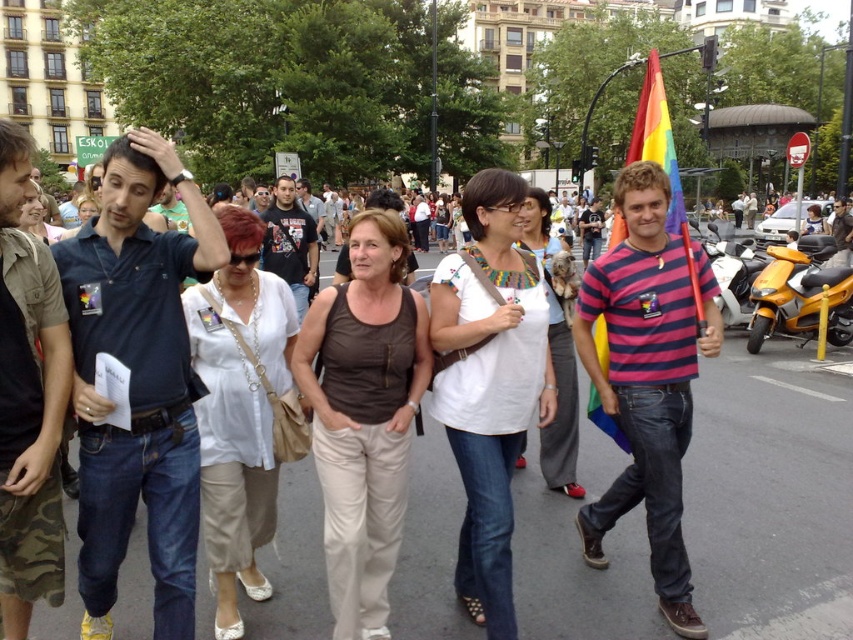
Question: Is brown cotton tank top at center wider than smooth white blouse at center?

Choices:
 (A) yes
 (B) no

Answer: (A)

Question: Is rainbow fabric flag at right smaller than yellow matte scooter at center?

Choices:
 (A) no
 (B) yes

Answer: (B)

Question: Estimate the real-world distances between objects in this image. Which object is closer to the smooth white blouse at center?

Choices:
 (A) orange matte scooter at right
 (B) camo-patterned shirt at left

Answer: (A)

Question: Which of these objects is positioned closest to the smooth white blouse at center?

Choices:
 (A) orange matte scooter at right
 (B) matte black t-shirt at center
 (C) brown cotton tank top at center

Answer: (A)

Question: Can you confirm if orange matte scooter at right is thinner than dark gray t-shirt at center?

Choices:
 (A) no
 (B) yes

Answer: (A)

Question: Which is nearer to the striped cotton t-shirt at center?

Choices:
 (A) dark gray t-shirt at center
 (B) orange matte scooter at right
 (C) white fabric dress at center

Answer: (C)